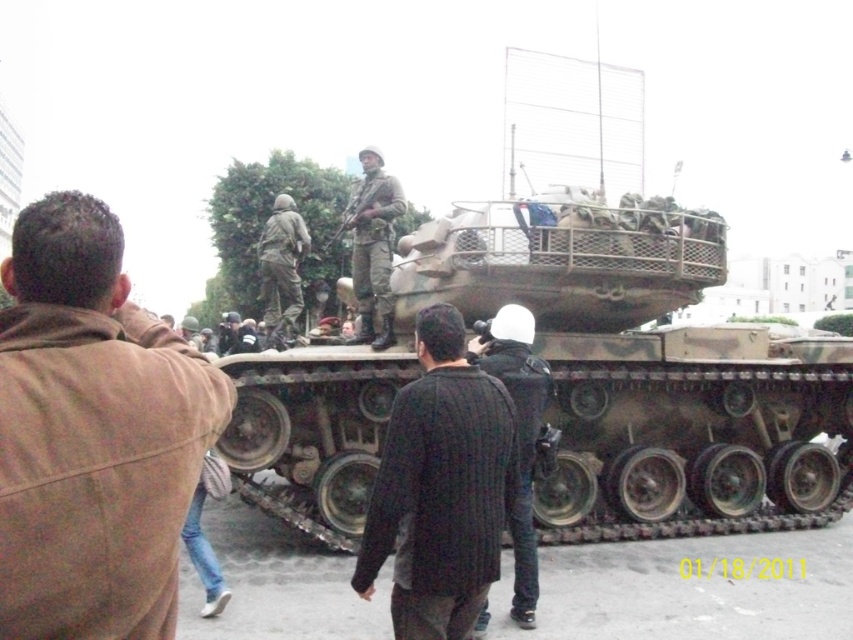
Is brown leather jacket at upper left thinner than camouflage fabric soldier at center?

Indeed, brown leather jacket at upper left has a lesser width compared to camouflage fabric soldier at center.

Between brown leather jacket at upper left and camouflage fabric soldier at center, which one has more height?

With more height is camouflage fabric soldier at center.

This screenshot has width=853, height=640. Identify the location of brown leather jacket at upper left. (91, 435).

Between camouflage paint tank at center and black ribbed sweater at center, which one is positioned higher?

Positioned higher is camouflage paint tank at center.

Is camouflage paint tank at center to the right of black ribbed sweater at center from the viewer's perspective?

Yes, camouflage paint tank at center is to the right of black ribbed sweater at center.

Between point (573, 536) and point (442, 422), which one is positioned in front?

Point (442, 422) is in front.

Locate an element on the screen. The width and height of the screenshot is (853, 640). camouflage paint tank at center is located at coordinates (572, 384).

Looking at this image, which is more to the left, black ribbed sweater at center or camouflage fabric soldier at center?

camouflage fabric soldier at center is more to the left.

How far apart are black ribbed sweater at center and camouflage fabric soldier at center?

black ribbed sweater at center and camouflage fabric soldier at center are 10.51 meters apart from each other.

Which is in front, point (387, 522) or point (283, 228)?

Point (387, 522) is in front.

This screenshot has height=640, width=853. Identify the location of black ribbed sweater at center. (440, 486).